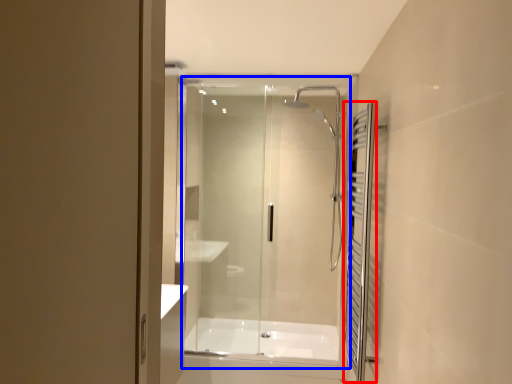
Question: Which of the following is the farthest to the observer, shower curtain (highlighted by a red box) or glass door (highlighted by a blue box)?

Choices:
 (A) shower curtain
 (B) glass door

Answer: (B)